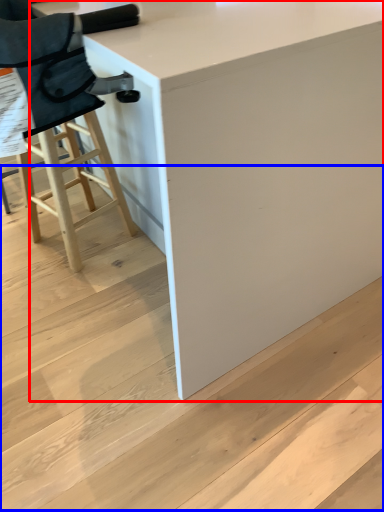
Question: Which object is closer to the camera taking this photo, table (highlighted by a red box) or stair (highlighted by a blue box)?

Choices:
 (A) table
 (B) stair

Answer: (A)